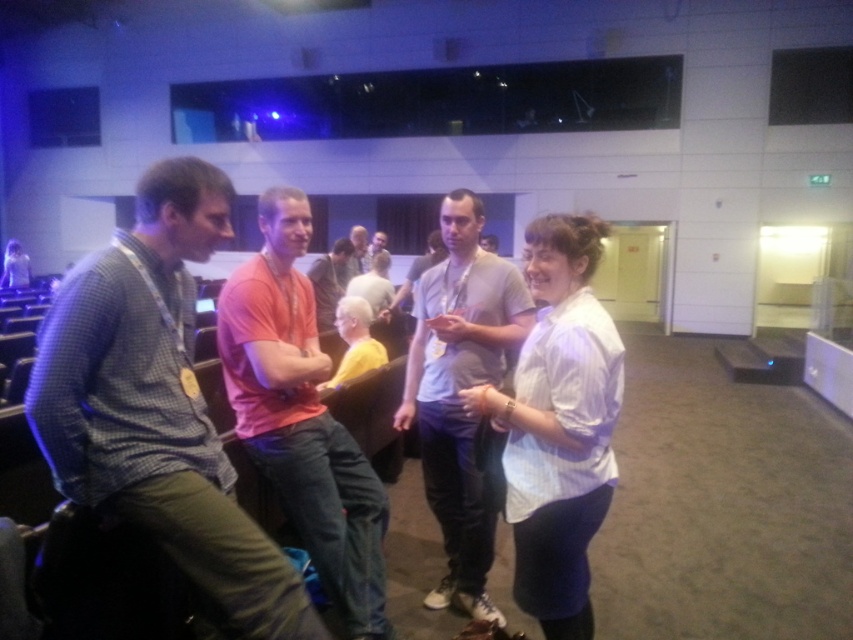
You are organizing a photo shoot and need to arrange the light gray cotton shirt at center and matte orange shirt at center based on their sizes. Which shirt should be placed first if you want the smaller one to be in front?

The light gray cotton shirt at center should be placed first since it has a smaller size compared to the matte orange shirt at center, allowing it to be positioned in front.

You are organizing a photo shoot and need to position two models wearing the checkered fabric shirt at left and matte gray shirt at center so that they are exactly 5 meters apart. Based on their current positions in the scene, do you need to move them closer together or farther apart to achieve this distance?

The checkered fabric shirt at left and matte gray shirt at center are currently 5.25 meters apart. To reach the desired 5 meters, you need to move them closer together by 0.25 meters.